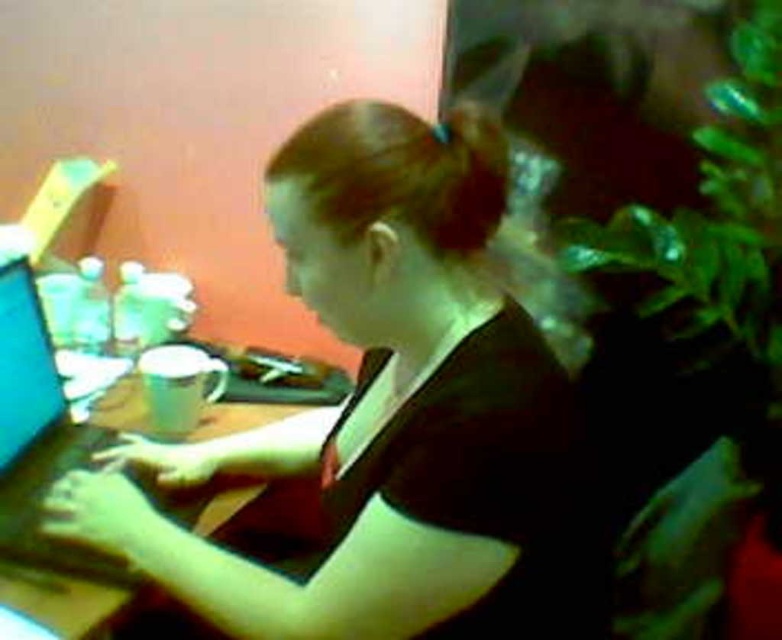
Question: Estimate the real-world distances between objects in this image. Which object is farther from the wooden table at center?

Choices:
 (A) shiny blue laptop at left
 (B) matte black shirt at center

Answer: (B)

Question: Which object is the farthest from the matte black shirt at center?

Choices:
 (A) wooden table at center
 (B) shiny blue laptop at left

Answer: (B)

Question: Can you confirm if wooden table at center is positioned below shiny blue laptop at left?

Choices:
 (A) no
 (B) yes

Answer: (B)

Question: Based on their relative distances, which object is nearer to the wooden table at center?

Choices:
 (A) shiny blue laptop at left
 (B) matte black shirt at center

Answer: (A)

Question: Is matte black shirt at center above wooden table at center?

Choices:
 (A) no
 (B) yes

Answer: (B)

Question: Is matte black shirt at center to the left of wooden table at center from the viewer's perspective?

Choices:
 (A) yes
 (B) no

Answer: (B)